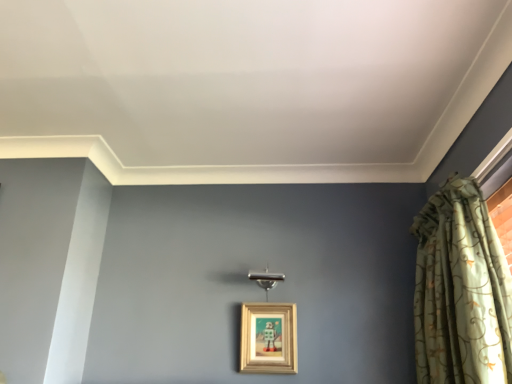
Measure the distance between point (260, 365) and camera.

The distance of point (260, 365) from camera is 2.14 meters.

What do you see at coordinates (268, 338) in the screenshot? The image size is (512, 384). I see `wooden frame at center` at bounding box center [268, 338].

In order to face wooden frame at center, should I rotate leftwards or rightwards?

Turn right approximately 1.585 degrees to face it.

At what (x,y) coordinates should I click in order to perform the action: click on wooden frame at center. Please return your answer as a coordinate pair (x, y). The height and width of the screenshot is (384, 512). Looking at the image, I should click on (268, 338).

Describe the element at coordinates (461, 290) in the screenshot. This screenshot has height=384, width=512. I see `green floral fabric curtain at right` at that location.

The width and height of the screenshot is (512, 384). Identify the location of green floral fabric curtain at right. (461, 290).

Based on the photo, what is the approximate height of green floral fabric curtain at right?

It is 34.52 inches.

Looking at this image, measure the distance between point (422, 345) and camera.

Point (422, 345) is 1.96 meters from camera.

I want to click on wooden frame at center, so click(268, 338).

Is wooden frame at center to the left of green floral fabric curtain at right from the viewer's perspective?

Correct, you'll find wooden frame at center to the left of green floral fabric curtain at right.

Which object is more forward, wooden frame at center or green floral fabric curtain at right?

green floral fabric curtain at right is in front.

Which point is more distant from viewer, (265, 303) or (485, 219)?

The point (265, 303) is more distant.

From the image's perspective, who appears lower, wooden frame at center or green floral fabric curtain at right?

wooden frame at center is shown below in the image.

From a real-world perspective, which object stands above the other?

From a 3D spatial view, green floral fabric curtain at right is above.

In terms of width, does wooden frame at center look wider or thinner when compared to green floral fabric curtain at right?

In the image, wooden frame at center appears to be more narrow than green floral fabric curtain at right.

From the picture: From their relative heights in the image, would you say wooden frame at center is taller or shorter than green floral fabric curtain at right?

Considering their sizes, wooden frame at center has less height than green floral fabric curtain at right.

In terms of size, does wooden frame at center appear bigger or smaller than green floral fabric curtain at right?

In the image, wooden frame at center appears to be smaller than green floral fabric curtain at right.

Do you think wooden frame at center is within green floral fabric curtain at right, or outside of it?

wooden frame at center exists outside the volume of green floral fabric curtain at right.

Would you say wooden frame at center is a long distance from green floral fabric curtain at right?

No, there isn't a large distance between wooden frame at center and green floral fabric curtain at right.

Is wooden frame at center looking in the opposite direction of green floral fabric curtain at right?

wooden frame at center is not turned away from green floral fabric curtain at right.

What's the angular difference between wooden frame at center and green floral fabric curtain at right's facing directions?

The angle between the facing direction of wooden frame at center and the facing direction of green floral fabric curtain at right is 90.5 degrees.

This screenshot has width=512, height=384. I want to click on curtain located above the wooden frame at center (from the image's perspective), so click(461, 290).

Which is more to the left, green floral fabric curtain at right or wooden frame at center?

wooden frame at center.

Is green floral fabric curtain at right closer to camera compared to wooden frame at center?

Yes.

Is point (496, 289) positioned in front of point (246, 308)?

Yes, it is in front of point (246, 308).

From the image's perspective, is green floral fabric curtain at right on wooden frame at center?

Correct, green floral fabric curtain at right appears higher than wooden frame at center in the image.

From a real-world perspective, is green floral fabric curtain at right beneath wooden frame at center?

Actually, green floral fabric curtain at right is physically above wooden frame at center in the real world.

Is green floral fabric curtain at right thinner than wooden frame at center?

Incorrect, the width of green floral fabric curtain at right is not less than that of wooden frame at center.

In terms of height, does green floral fabric curtain at right look taller or shorter compared to wooden frame at center?

In the image, green floral fabric curtain at right appears to be taller than wooden frame at center.

Considering the sizes of objects green floral fabric curtain at right and wooden frame at center in the image provided, who is smaller, green floral fabric curtain at right or wooden frame at center?

wooden frame at center is smaller.

Is wooden frame at center a part of green floral fabric curtain at right?

No, wooden frame at center is not surrounded by green floral fabric curtain at right.

Is there a large distance between green floral fabric curtain at right and wooden frame at center?

No, green floral fabric curtain at right is in close proximity to wooden frame at center.

Is green floral fabric curtain at right oriented towards wooden frame at center?

Yes, green floral fabric curtain at right is facing wooden frame at center.

How many degrees apart are the facing directions of green floral fabric curtain at right and wooden frame at center?

green floral fabric curtain at right and wooden frame at center are facing 90.5 degrees away from each other.

How far apart are green floral fabric curtain at right and wooden frame at center?

The distance of green floral fabric curtain at right from wooden frame at center is 29.87 inches.

Locate an element on the screen. Image resolution: width=512 pixels, height=384 pixels. picture frame below the green floral fabric curtain at right (from the image's perspective) is located at coordinates (268, 338).

Image resolution: width=512 pixels, height=384 pixels. I want to click on curtain in front of the wooden frame at center, so click(x=461, y=290).

This screenshot has width=512, height=384. I want to click on curtain above the wooden frame at center (from a real-world perspective), so click(x=461, y=290).